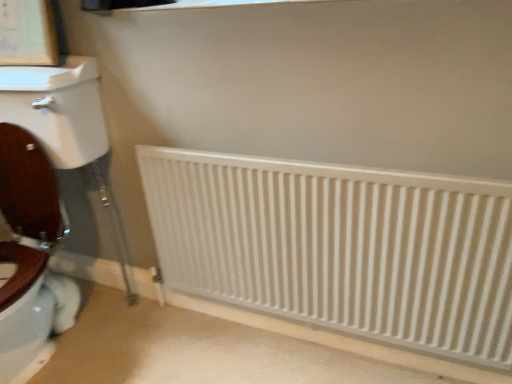
Describe the element at coordinates (340, 247) in the screenshot. I see `white matte radiator at lower center` at that location.

Where is `white matte radiator at lower center`? The height and width of the screenshot is (384, 512). white matte radiator at lower center is located at coordinates (340, 247).

Image resolution: width=512 pixels, height=384 pixels. Find the location of `white matte radiator at lower center`. white matte radiator at lower center is located at coordinates [x=340, y=247].